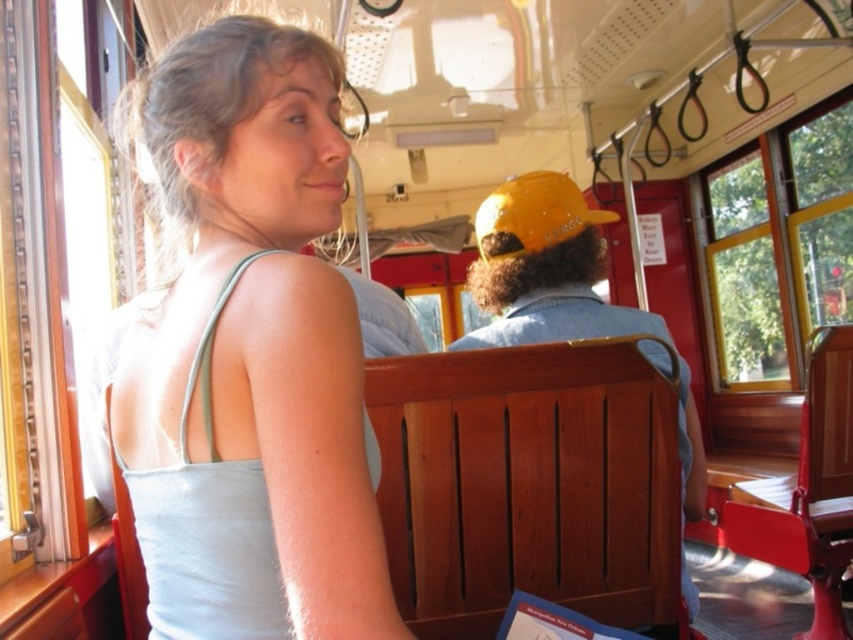
Question: Can you confirm if white matte tank top at upper left is thinner than wooden bench at center?

Choices:
 (A) no
 (B) yes

Answer: (B)

Question: Does white matte tank top at upper left have a lesser width compared to wooden bench at center?

Choices:
 (A) no
 (B) yes

Answer: (B)

Question: Which point is closer to the camera taking this photo?

Choices:
 (A) (566, 298)
 (B) (154, 163)

Answer: (B)

Question: Among these objects, which one is nearest to the camera?

Choices:
 (A) wooden bench at center
 (B) white matte tank top at upper left

Answer: (B)

Question: Does white matte tank top at upper left appear under wooden bench at center?

Choices:
 (A) yes
 (B) no

Answer: (B)

Question: Which object is closer to the camera taking this photo?

Choices:
 (A) white matte tank top at upper left
 (B) wooden bench at center

Answer: (A)